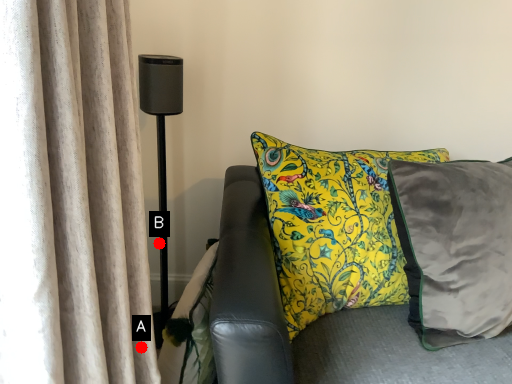
Question: Two points are circled on the image, labeled by A and B beside each circle. Which of the following is the closest to the observer?

Choices:
 (A) A is closer
 (B) B is closer

Answer: (A)